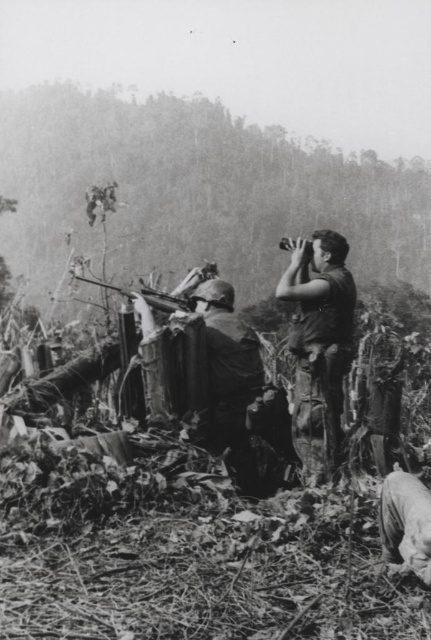
In the historical military photograph, there are several soldiers positioned among dense foliage and debris. You notice a point marked at coordinates [318,342]. Which object from the scene is located at this point?

The point at coordinates [318,342] corresponds to camouflage pants at right.

You are a soldier in the forest and need to locate your camouflage pants at right. Based on the coordinates provided, where should you look to find them?

The camouflage pants at right are located at the 2D coordinates point (x=318, y=342).

Based on the photo, based on the scene described, which object is positioned lower in the image? The camouflage pants at right or the metallic rifle at center?

The camouflage pants at right is positioned below the metallic rifle at center, so it is lower in the image.